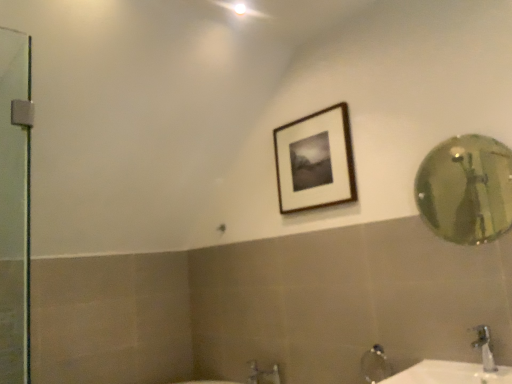
What do you see at coordinates (450, 374) in the screenshot? I see `white glossy sink at lower right` at bounding box center [450, 374].

You are a GUI agent. You are given a task and a screenshot of the screen. Output one action in this format:
    pyautogui.click(x=<x>, y=<y>)
    Task: Click on the silver metallic faucet at lower right
    The height and width of the screenshot is (384, 512).
    Given the screenshot: What is the action you would take?
    pyautogui.click(x=484, y=348)

At what (x,y) coordinates should I click in order to perform the action: click on white glossy sink at lower right. Please return your answer as a coordinate pair (x, y). The width and height of the screenshot is (512, 384). Looking at the image, I should click on (450, 374).

Between gold reflective mirror at right and white glossy sink at lower right, which one has smaller size?

gold reflective mirror at right.

From the image's perspective, between gold reflective mirror at right and white glossy sink at lower right, which one is located above?

gold reflective mirror at right is shown above in the image.

Between gold reflective mirror at right and white glossy sink at lower right, which one has more height?

With more height is gold reflective mirror at right.

In the scene shown: Would you say gold reflective mirror at right is outside white glossy sink at lower right?

Yes, gold reflective mirror at right is located beyond the bounds of white glossy sink at lower right.

Between wooden framed picture at upper center and silver metallic faucet at lower right, which one has more height?

wooden framed picture at upper center is taller.

Is wooden framed picture at upper center in front of silver metallic faucet at lower right?

No, it is behind silver metallic faucet at lower right.

Where is `picture frame that is above the silver metallic faucet at lower right (from the image's perspective)`? This screenshot has height=384, width=512. picture frame that is above the silver metallic faucet at lower right (from the image's perspective) is located at coordinates (315, 161).

Is point (319, 133) farther from viewer compared to point (489, 341)?

Yes, point (319, 133) is farther from viewer.

Consider the image. Is gold reflective mirror at right taller or shorter than wooden framed picture at upper center?

Clearly, gold reflective mirror at right is shorter compared to wooden framed picture at upper center.

Is gold reflective mirror at right positioned beyond the bounds of wooden framed picture at upper center?

Absolutely, gold reflective mirror at right is external to wooden framed picture at upper center.

Consider the image. Which point is more forward, (469, 176) or (340, 121)?

The point (340, 121) is closer.

In the image, there is a wooden framed picture at upper center. Where is `mirror below it (from the image's perspective)`? mirror below it (from the image's perspective) is located at coordinates (466, 189).

Is white glossy sink at lower right aimed at wooden framed picture at upper center?

No, white glossy sink at lower right is not facing towards wooden framed picture at upper center.

From a real-world perspective, is white glossy sink at lower right positioned above or below wooden framed picture at upper center?

white glossy sink at lower right is below wooden framed picture at upper center.

Is white glossy sink at lower right to the left of wooden framed picture at upper center from the viewer's perspective?

No, white glossy sink at lower right is not to the left of wooden framed picture at upper center.

Is point (459, 364) closer to camera compared to point (346, 169)?

Yes.

Is wooden framed picture at upper center facing towards gold reflective mirror at right?

No, wooden framed picture at upper center does not turn towards gold reflective mirror at right.

Is there a large distance between wooden framed picture at upper center and gold reflective mirror at right?

Yes.

Which object is further away from the camera taking this photo, wooden framed picture at upper center or gold reflective mirror at right?

wooden framed picture at upper center is further away from the camera.

Is white glossy sink at lower right in contact with silver metallic faucet at lower right?

There is a gap between white glossy sink at lower right and silver metallic faucet at lower right.

Does white glossy sink at lower right lie behind silver metallic faucet at lower right?

No.

How much distance is there between white glossy sink at lower right and silver metallic faucet at lower right?

white glossy sink at lower right is 12.77 centimeters from silver metallic faucet at lower right.

In the scene shown: Would you say white glossy sink at lower right is inside or outside silver metallic faucet at lower right?

The correct answer is: outside.

Is white glossy sink at lower right far away from gold reflective mirror at right?

Yes, white glossy sink at lower right and gold reflective mirror at right are quite far apart.

Considering the relative sizes of white glossy sink at lower right and gold reflective mirror at right in the image provided, is white glossy sink at lower right wider than gold reflective mirror at right?

Yes, white glossy sink at lower right is wider than gold reflective mirror at right.

Which is more to the right, white glossy sink at lower right or gold reflective mirror at right?

gold reflective mirror at right.

Looking at this image, can you confirm if white glossy sink at lower right is bigger than gold reflective mirror at right?

Correct, white glossy sink at lower right is larger in size than gold reflective mirror at right.

The width and height of the screenshot is (512, 384). Find the location of `mirror behind the white glossy sink at lower right`. mirror behind the white glossy sink at lower right is located at coordinates (466, 189).

Where is `tap on the right of wooden framed picture at upper center`? The width and height of the screenshot is (512, 384). tap on the right of wooden framed picture at upper center is located at coordinates (484, 348).

From the image, which object appears to be nearer to gold reflective mirror at right, silver metallic faucet at lower right or wooden framed picture at upper center?

wooden framed picture at upper center is closer to gold reflective mirror at right.

Based on their spatial positions, is white glossy sink at lower right or silver metallic faucet at lower right further from gold reflective mirror at right?

silver metallic faucet at lower right lies further to gold reflective mirror at right than the other object.

Based on their spatial positions, is gold reflective mirror at right or silver metallic faucet at lower right closer to white glossy sink at lower right?

Based on the image, silver metallic faucet at lower right appears to be nearer to white glossy sink at lower right.

From the image, which object appears to be nearer to silver metallic faucet at lower right, wooden framed picture at upper center or white glossy sink at lower right?

white glossy sink at lower right.

Which object lies nearer to the anchor point silver metallic faucet at lower right, gold reflective mirror at right or white glossy sink at lower right?

white glossy sink at lower right lies closer to silver metallic faucet at lower right than the other object.

Estimate the real-world distances between objects in this image. Which object is closer to silver metallic faucet at lower right, wooden framed picture at upper center or gold reflective mirror at right?

Among the two, wooden framed picture at upper center is located nearer to silver metallic faucet at lower right.

From the image, which object appears to be farther from gold reflective mirror at right, wooden framed picture at upper center or white glossy sink at lower right?

The object further to gold reflective mirror at right is white glossy sink at lower right.

When comparing their distances from white glossy sink at lower right, does silver metallic faucet at lower right or gold reflective mirror at right seem further?

gold reflective mirror at right.

You are a GUI agent. You are given a task and a screenshot of the screen. Output one action in this format:
    pyautogui.click(x=<x>, y=<y>)
    Task: Click on the tap between gold reflective mirror at right and white glossy sink at lower right from top to bottom
    The image size is (512, 384).
    Given the screenshot: What is the action you would take?
    pyautogui.click(x=484, y=348)

Locate an element on the screen. This screenshot has width=512, height=384. mirror between wooden framed picture at upper center and silver metallic faucet at lower right from top to bottom is located at coordinates (466, 189).

Where is `mirror between wooden framed picture at upper center and white glossy sink at lower right from top to bottom`? The image size is (512, 384). mirror between wooden framed picture at upper center and white glossy sink at lower right from top to bottom is located at coordinates (466, 189).

At what (x,y) coordinates should I click in order to perform the action: click on tap between wooden framed picture at upper center and white glossy sink at lower right in the vertical direction. Please return your answer as a coordinate pair (x, y). The width and height of the screenshot is (512, 384). Looking at the image, I should click on (484, 348).